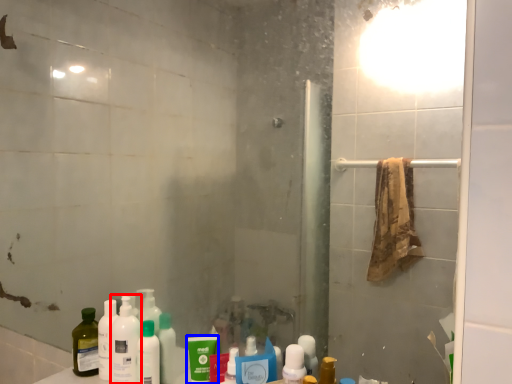
Question: Which object is further to the camera taking this photo, cleaning product (highlighted by a red box) or mouthwash (highlighted by a blue box)?

Choices:
 (A) cleaning product
 (B) mouthwash

Answer: (A)